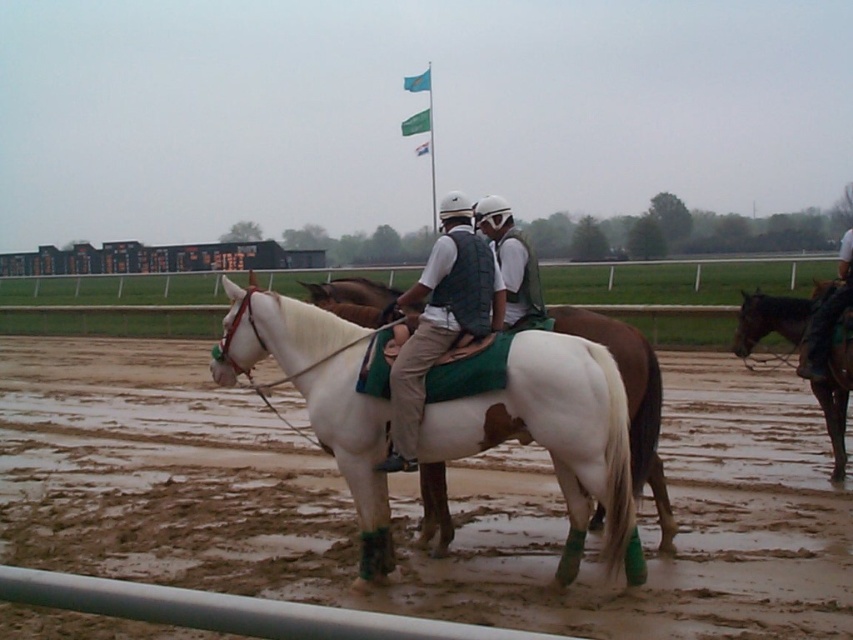
You are a photographer planning to take a photo of the white glossy horse at center and the white matte dirt field at center. Based on their heights, which object should you focus on first to ensure proper depth of field?

The white glossy horse at center is taller than the white matte dirt field at center, so you should focus on the white glossy horse at center first to ensure proper depth of field.

You are a photographer standing at the center of the horse racing track. You see a brown glossy horse at right represented by point (773, 317). Can you take a clear photo of the brown glossy horse at right without any obstructions?

The brown glossy horse at right is represented by point (773, 317). Since the foreground shows two individuals seated on a white horse, which may block the view towards the right side, there might be obstructions. Check if the white horse is between you and the point (773, 317) before taking the photo.